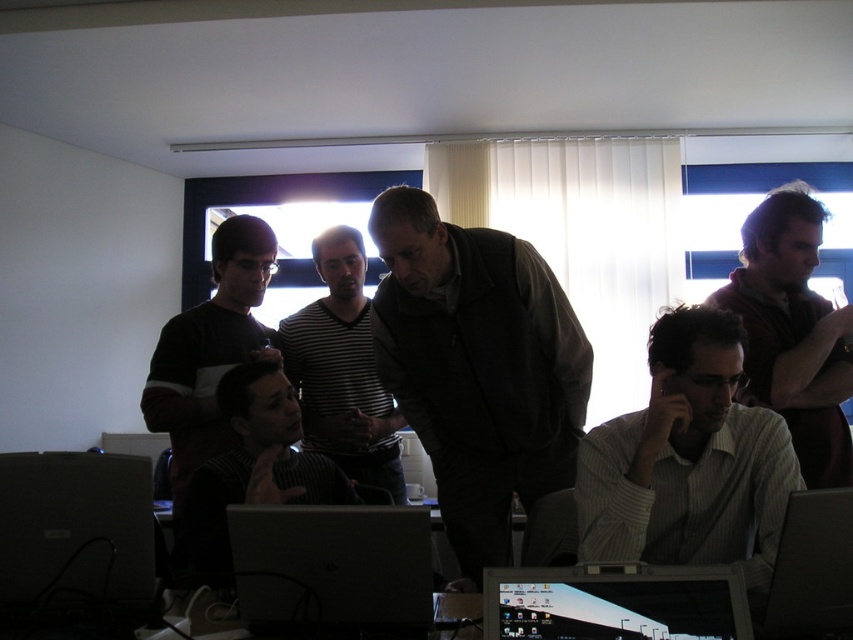
Question: Which object is positioned closest to the matte black monitor at lower center?

Choices:
 (A) striped sweater at center
 (B) striped shirt at center

Answer: (A)

Question: Is silver metallic laptop at center positioned at the back of matte black monitor at lower center?

Choices:
 (A) yes
 (B) no

Answer: (A)

Question: Can you confirm if white striped shirt at center is wider than black knitwear at center?

Choices:
 (A) yes
 (B) no

Answer: (B)

Question: Can you confirm if striped shirt at center is thinner than black knitwear at center?

Choices:
 (A) yes
 (B) no

Answer: (A)

Question: Which object appears closest to the camera in this image?

Choices:
 (A) dark brown sweater at right
 (B) metallic silver laptop at lower right

Answer: (B)

Question: Which point appears closest to the camera in this image?

Choices:
 (A) (44, 520)
 (B) (260, 525)

Answer: (B)